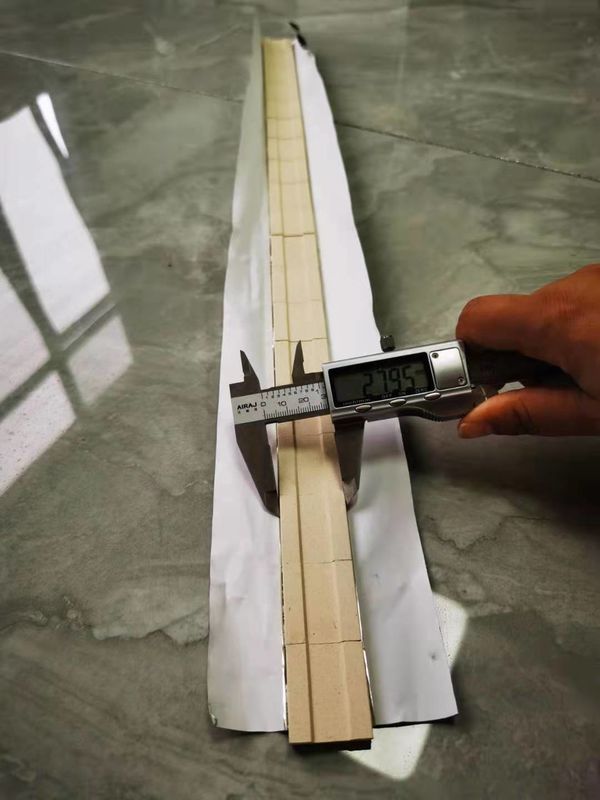
Image resolution: width=600 pixels, height=800 pixels. Identify the location of dark marble. (517, 180).